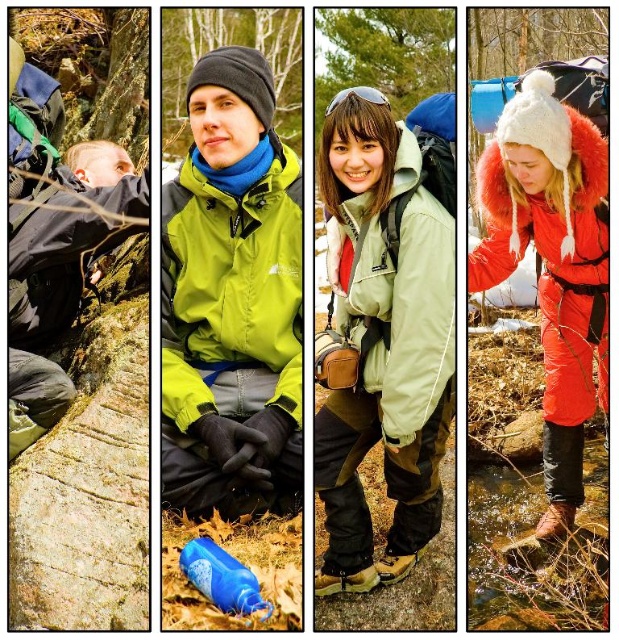
Question: Is green matte jacket at center to the left of blue matte water bottle at center from the viewer's perspective?

Choices:
 (A) yes
 (B) no

Answer: (A)

Question: Can you confirm if matte green jacket at center is wider than green matte jacket at center?

Choices:
 (A) yes
 (B) no

Answer: (B)

Question: Does matte green jacket at center have a greater width compared to blue matte water bottle at center?

Choices:
 (A) yes
 (B) no

Answer: (A)

Question: Which is nearer to the green matte jacket at center?

Choices:
 (A) matte green jacket at center
 (B) fuzzy white hat at upper right
 (C) blue matte water bottle at center

Answer: (A)

Question: Considering the real-world distances, which object is farthest from the green matte jacket at center?

Choices:
 (A) fuzzy white hat at upper right
 (B) matte green jacket at center
 (C) blue matte water bottle at center

Answer: (A)

Question: Estimate the real-world distances between objects in this image. Which object is closer to the matte green jacket at center?

Choices:
 (A) green matte jacket at center
 (B) fuzzy white hat at upper right

Answer: (A)